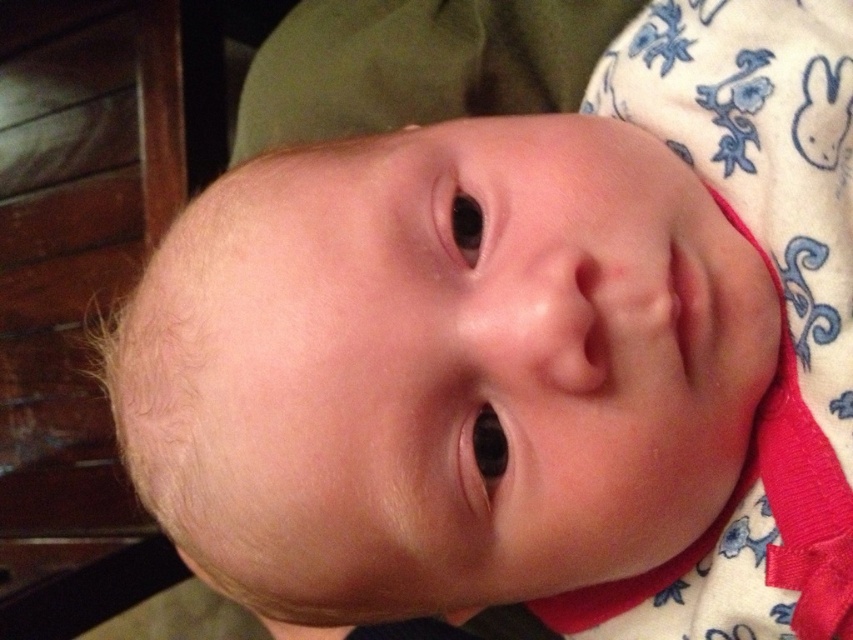
You are a photographer adjusting the focus on your camera. You notice two points in the image, point 1 at coordinates point [705,304] and point 2 at coordinates point [468,442]. Which point is closer to the camera lens?

Point [705,304] is further to the viewer than point [468,442], so point [468,442] is closer to the camera lens.

You are a photographer adjusting the focus on your camera. The subject is a baby with pink smooth skin at center. Where should you aim the focus point to capture the baby accurately?

The pink smooth skin at center is located at point (x=688, y=307), so you should aim the focus point at those coordinates to capture the baby accurately.